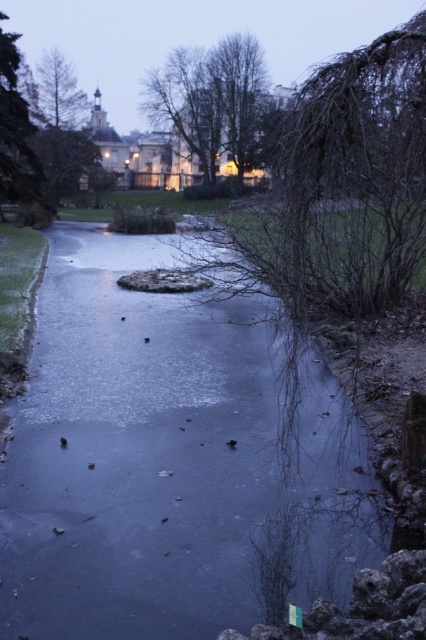
You are standing at the origin point of the coordinate system. Looking at the image, where is the green leafy tree at center located in terms of coordinates?

The green leafy tree at center is located at coordinates point (x=213, y=100).

You are standing at the center of the frozen pond and see the point marked at coordinates (334, 200). What is located at that point?

The point at coordinates (334, 200) is occupied by the bare branches at center.